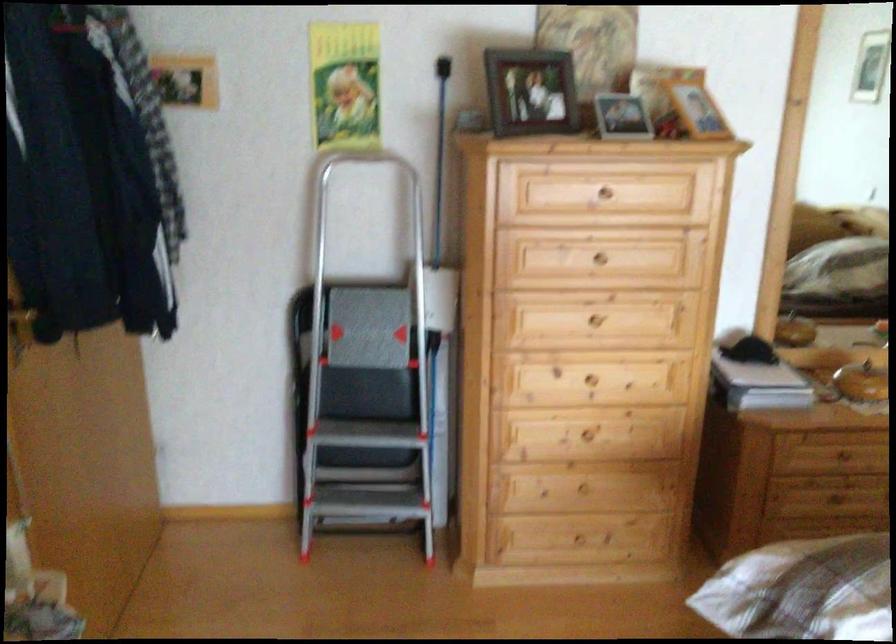
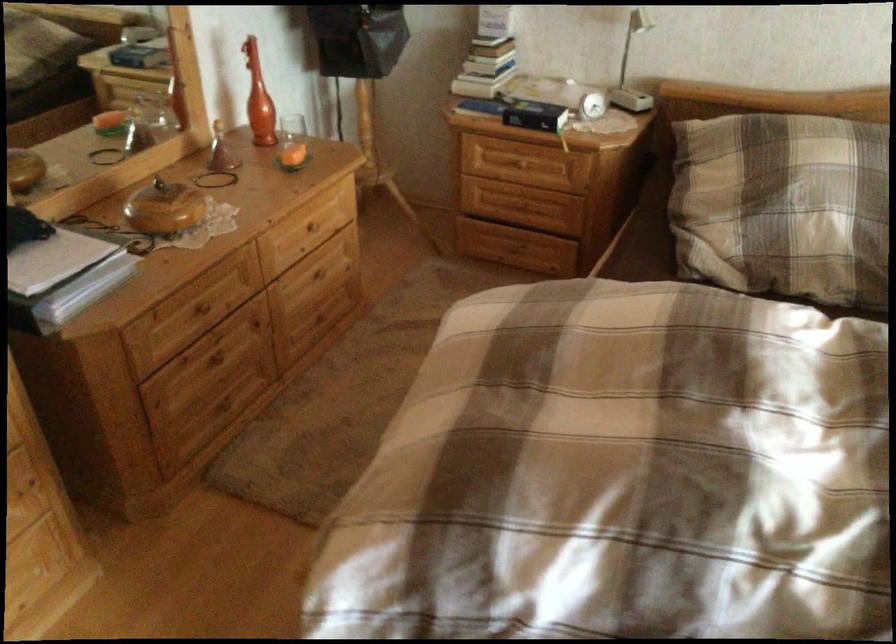
Find the pixel in the second image that matches [768,366] in the first image.

(55, 260)